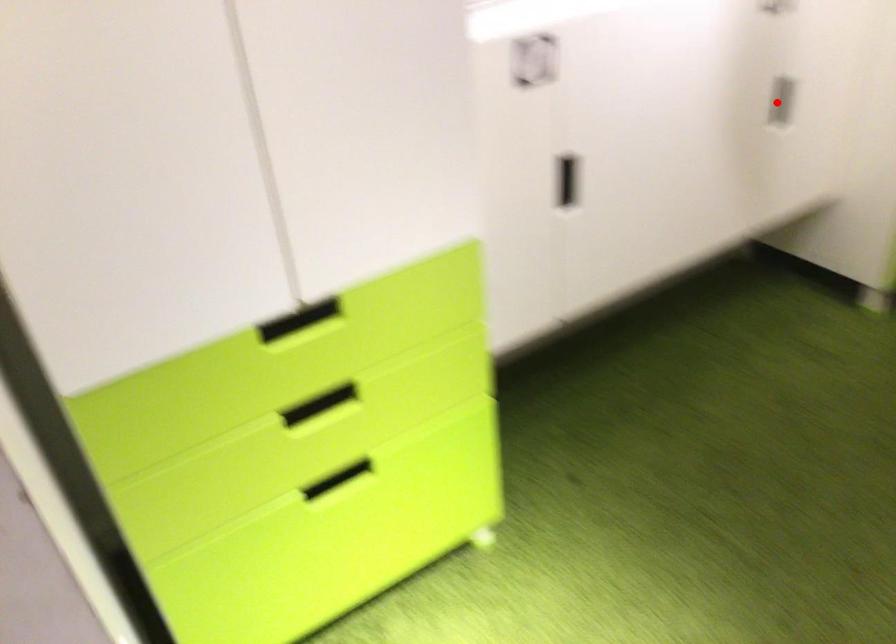
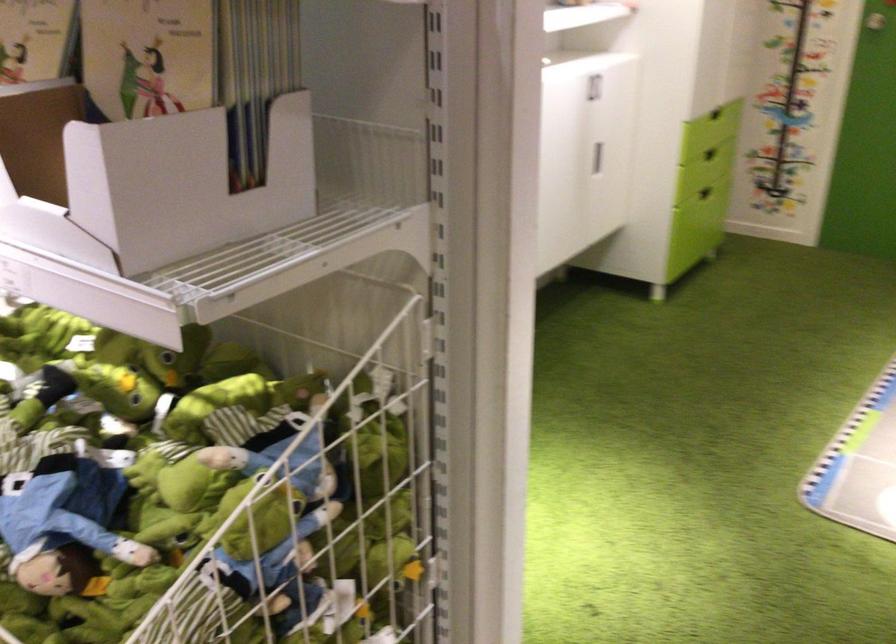
In the second image, find the point that corresponds to the highlighted location in the first image.

(597, 158)